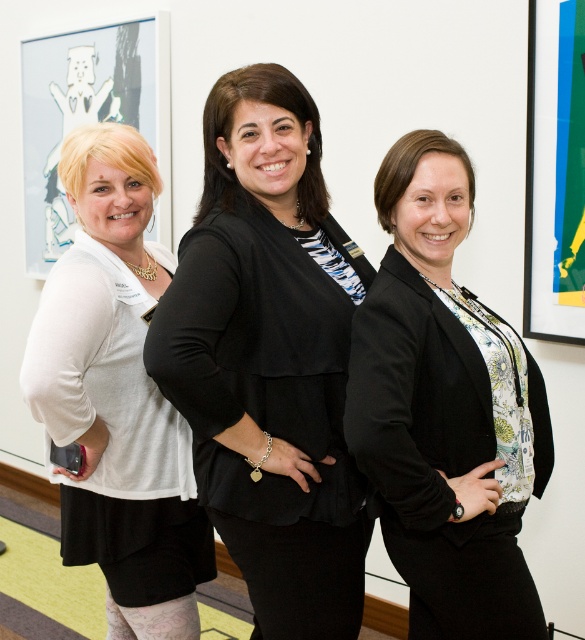
Based on the photo, does matte black blazer at center appear over white matte shirt at left?

Correct, matte black blazer at center is located above white matte shirt at left.

This screenshot has height=640, width=585. I want to click on matte black blazer at center, so click(445, 410).

This screenshot has width=585, height=640. Identify the location of matte black blazer at center. (445, 410).

Locate an element on the screen. The image size is (585, 640). matte black blazer at center is located at coordinates (445, 410).

Who is higher up, black matte blazer at center or white matte shirt at left?

Positioned higher is black matte blazer at center.

You are a GUI agent. You are given a task and a screenshot of the screen. Output one action in this format:
    pyautogui.click(x=<x>, y=<y>)
    Task: Click on the black matte blazer at center
    Image resolution: width=585 pixels, height=640 pixels.
    Given the screenshot: What is the action you would take?
    pyautogui.click(x=270, y=358)

Can you confirm if black matte blazer at center is smaller than matte black blazer at center?

Incorrect, black matte blazer at center is not smaller in size than matte black blazer at center.

Is black matte blazer at center below matte black blazer at center?

No, black matte blazer at center is not below matte black blazer at center.

Find the location of `black matte blazer at center`. black matte blazer at center is located at coordinates (270, 358).

The image size is (585, 640). Identify the location of black matte blazer at center. (270, 358).